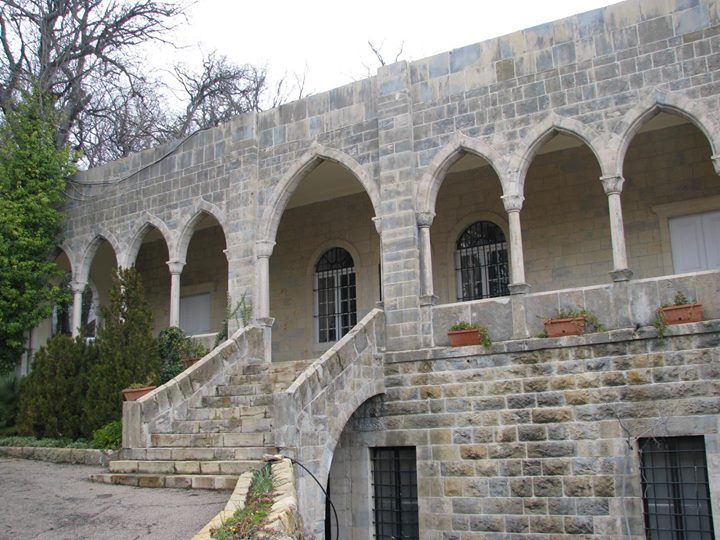
At what (x,y) coordinates should I click in order to perform the action: click on window. Please return your answer as a coordinate pair (x, y). This screenshot has height=540, width=720. Looking at the image, I should click on (338, 303), (482, 280), (397, 484), (666, 487).